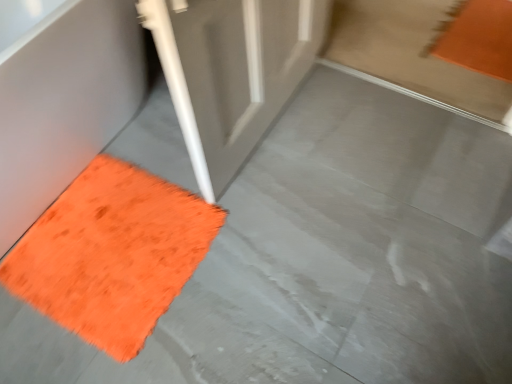
Question: From a real-world perspective, is orange shaggy bath mat at lower left above or below orange fuzzy mat at lower left?

Choices:
 (A) above
 (B) below

Answer: (A)

Question: Is orange shaggy bath mat at lower left inside or outside of orange fuzzy mat at lower left?

Choices:
 (A) inside
 (B) outside

Answer: (B)

Question: From their relative heights in the image, would you say orange shaggy bath mat at lower left is taller or shorter than orange fuzzy mat at lower left?

Choices:
 (A) tall
 (B) short

Answer: (A)

Question: From a real-world perspective, is orange fuzzy mat at lower left above or below orange shaggy bath mat at lower left?

Choices:
 (A) above
 (B) below

Answer: (B)

Question: Considering the positions of orange fuzzy mat at lower left and orange shaggy bath mat at lower left in the image, is orange fuzzy mat at lower left taller or shorter than orange shaggy bath mat at lower left?

Choices:
 (A) tall
 (B) short

Answer: (B)

Question: Is orange fuzzy mat at lower left to the left or to the right of orange shaggy bath mat at lower left in the image?

Choices:
 (A) right
 (B) left

Answer: (A)

Question: Choose the correct answer: Is orange fuzzy mat at lower left inside orange shaggy bath mat at lower left or outside it?

Choices:
 (A) inside
 (B) outside

Answer: (B)